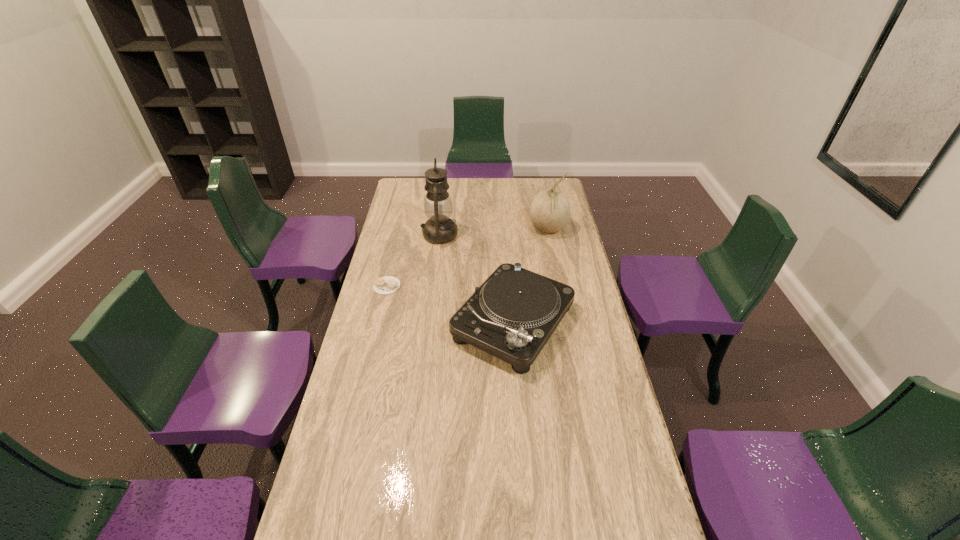
I want to click on cantaloup present at the right edge, so click(x=549, y=212).

At what (x,y) coordinates should I click in order to perform the action: click on record player positioned at the right edge. Please return your answer as a coordinate pair (x, y). This screenshot has width=960, height=540. Looking at the image, I should click on (511, 316).

Where is `free space at the far edge of the desktop`? free space at the far edge of the desktop is located at coordinates (449, 190).

At what (x,y) coordinates should I click in order to perform the action: click on vacant region at the left edge of the desktop. Please return your answer as a coordinate pair (x, y). The width and height of the screenshot is (960, 540). Looking at the image, I should click on (371, 397).

You are a GUI agent. You are given a task and a screenshot of the screen. Output one action in this format:
    pyautogui.click(x=<x>, y=<y>)
    Task: Click on the free region at the right edge of the desktop
    The width and height of the screenshot is (960, 540).
    Given the screenshot: What is the action you would take?
    pyautogui.click(x=587, y=441)

Locate an element on the screen. free space between the third tallest object and the leftmost object is located at coordinates (450, 305).

Locate an element on the screen. The height and width of the screenshot is (540, 960). empty space that is in between the tallest object and the second tallest object is located at coordinates click(493, 232).

Image resolution: width=960 pixels, height=540 pixels. I want to click on empty location between the shortest object and the second shortest object, so click(x=450, y=305).

Find the location of a particular element. Image resolution: width=960 pixels, height=540 pixels. free spot between the tallest object and the cantaloup is located at coordinates (493, 232).

This screenshot has height=540, width=960. In order to click on free space between the leftmost object and the cantaloup in this screenshot , I will do `click(468, 258)`.